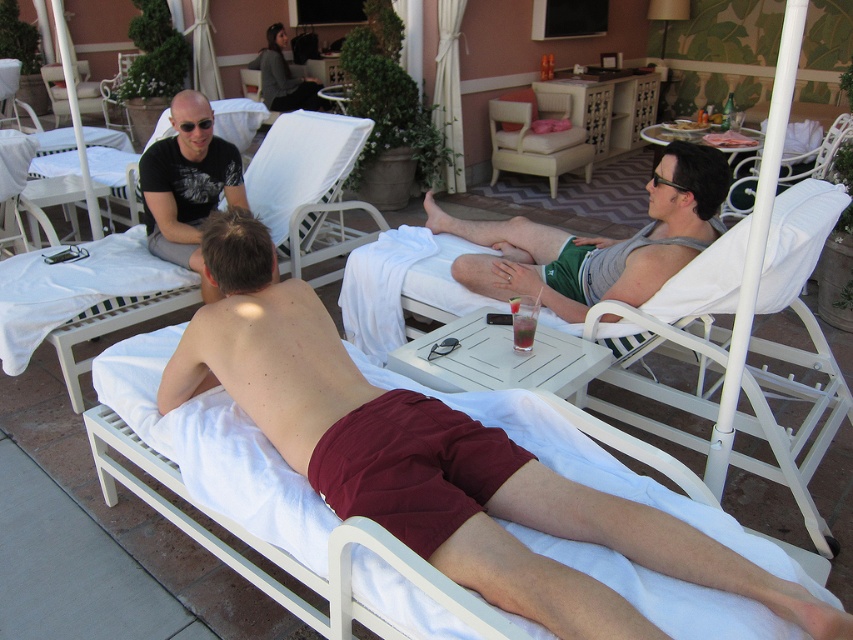
You are organizing a small outdoor event and need to arrange seating. You have a space that can only accommodate items up to the width of the white fabric chair at upper right. Can the burgundy cotton shorts at lower left fit in this space?

The burgundy cotton shorts at lower left has a larger width than the white fabric chair at upper right, so it cannot fit in the space allocated for items up to the chair width.

You are designing a layout for a new outdoor lounge and want to ensure that the green cotton shorts at center and the white plastic beach chair at upper left are proportionally sized. Based on the scene, which object should be the smaller one in your design?

The green cotton shorts at center should be the smaller one since the description states that it has a smaller size compared to the white plastic beach chair at upper left.